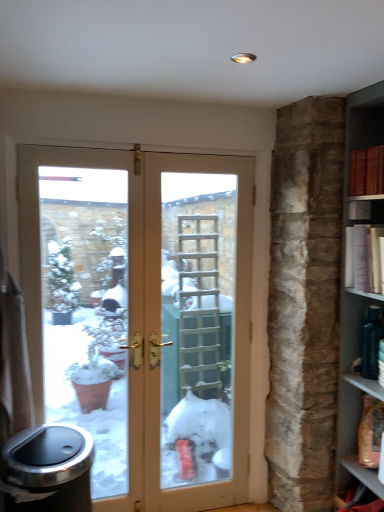
Question: Considering their positions, is shiny metallic trash can at lower left located in front of or behind red leather book at upper right, the first book from the top?

Choices:
 (A) behind
 (B) front

Answer: (B)

Question: From a real-world perspective, is shiny metallic trash can at lower left physically located above or below red leather book at upper right, the first book from the top?

Choices:
 (A) below
 (B) above

Answer: (A)

Question: Estimate the real-world distances between objects in this image. Which object is closer to the matte brown wood at lower right?

Choices:
 (A) shiny metallic trash can at lower left
 (B) red leather book at upper right, the first book from the top
 (C) white paper bookshelf at right, which is the first book in bottom-to-top order

Answer: (C)

Question: Based on their relative distances, which object is farther from the white paper bookshelf at right, which is the first book in bottom-to-top order?

Choices:
 (A) red leather book at upper right, the first book from the top
 (B) shiny metallic trash can at lower left
 (C) matte brown wood at lower right

Answer: (B)